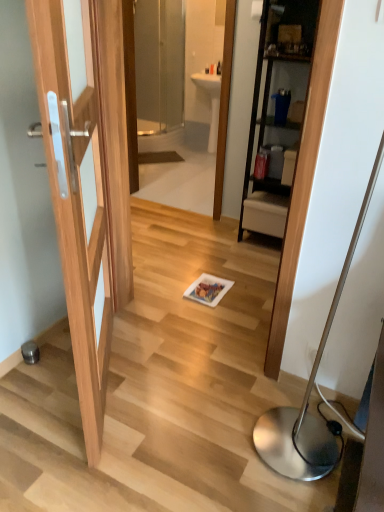
I want to click on free space underneath transparent glass mirror at upper center (from a real-world perspective), so click(x=164, y=204).